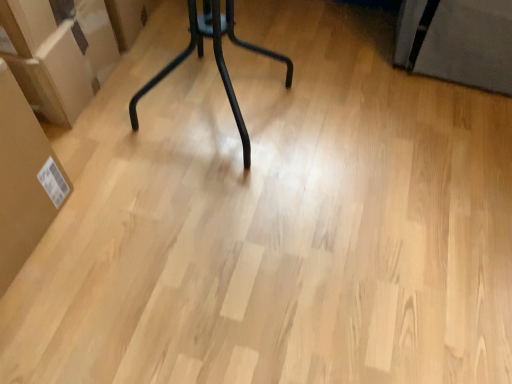
Question: Is matte brown cardboard at left, arranged as the 1th cardboard box when viewed from the top, not near brown cardboard box at left, placed as the first cardboard box when sorted from front to back?

Choices:
 (A) no
 (B) yes

Answer: (A)

Question: From a real-world perspective, is matte brown cardboard at left, which is counted as the 1th cardboard box, starting from the back, on brown cardboard box at left, which ranks as the 1th cardboard box in bottom-to-top order?

Choices:
 (A) yes
 (B) no

Answer: (B)

Question: From the image's perspective, is matte brown cardboard at left, placed as the 2th cardboard box when sorted from front to back, below brown cardboard box at left, which ranks as the 2th cardboard box in top-to-bottom order?

Choices:
 (A) yes
 (B) no

Answer: (B)

Question: Is matte brown cardboard at left, arranged as the 1th cardboard box when viewed from the top, to the right of brown cardboard box at left, placed as the first cardboard box when sorted from front to back, from the viewer's perspective?

Choices:
 (A) yes
 (B) no

Answer: (B)

Question: Does matte brown cardboard at left, which is counted as the 1th cardboard box, starting from the back, have a greater width compared to brown cardboard box at left, placed as the first cardboard box when sorted from front to back?

Choices:
 (A) no
 (B) yes

Answer: (B)

Question: Is matte brown cardboard at left, arranged as the 1th cardboard box when viewed from the top, with brown cardboard box at left, which ranks as the 1th cardboard box in bottom-to-top order?

Choices:
 (A) no
 (B) yes

Answer: (A)

Question: Does brown cardboard box at left, which ranks as the 2th cardboard box in top-to-bottom order, have a larger size compared to matte brown cardboard at left, which is counted as the 1th cardboard box, starting from the back?

Choices:
 (A) no
 (B) yes

Answer: (A)

Question: Is brown cardboard box at left, arranged as the 2th cardboard box when viewed from the back, turned away from matte brown cardboard at left, which ranks as the 2th cardboard box in bottom-to-top order?

Choices:
 (A) no
 (B) yes

Answer: (A)

Question: From a real-world perspective, is brown cardboard box at left, placed as the first cardboard box when sorted from front to back, located higher than matte brown cardboard at left, which ranks as the 2th cardboard box in bottom-to-top order?

Choices:
 (A) no
 (B) yes

Answer: (B)

Question: Considering the relative sizes of brown cardboard box at left, arranged as the 2th cardboard box when viewed from the back, and matte brown cardboard at left, which is counted as the 1th cardboard box, starting from the back, in the image provided, is brown cardboard box at left, arranged as the 2th cardboard box when viewed from the back, smaller than matte brown cardboard at left, which is counted as the 1th cardboard box, starting from the back,?

Choices:
 (A) no
 (B) yes

Answer: (B)

Question: From the image's perspective, is brown cardboard box at left, which ranks as the 1th cardboard box in bottom-to-top order, located above matte brown cardboard at left, placed as the 2th cardboard box when sorted from front to back?

Choices:
 (A) no
 (B) yes

Answer: (A)

Question: Can you confirm if brown cardboard box at left, arranged as the 2th cardboard box when viewed from the back, is thinner than matte brown cardboard at left, placed as the 2th cardboard box when sorted from front to back?

Choices:
 (A) yes
 (B) no

Answer: (A)

Question: Is matte brown cardboard at left, which ranks as the 2th cardboard box in bottom-to-top order, bigger or smaller than brown cardboard box at left, which ranks as the 2th cardboard box in top-to-bottom order?

Choices:
 (A) big
 (B) small

Answer: (A)